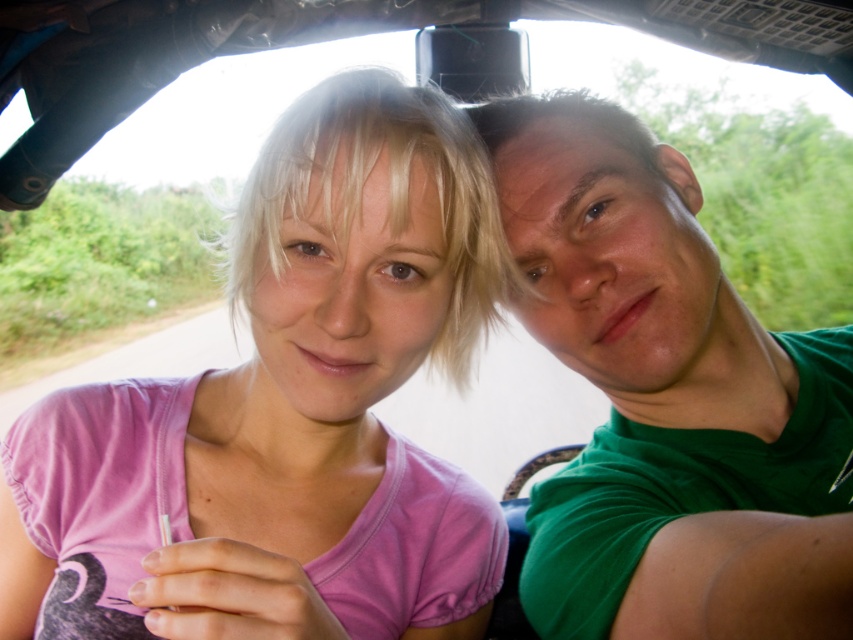
Question: Among these objects, which one is farthest from the camera?

Choices:
 (A) green matte shirt at right
 (B) pink fabric shirt at center

Answer: (B)

Question: Which point appears farthest from the camera in this image?

Choices:
 (A) click(578, 179)
 (B) click(149, 561)

Answer: (A)

Question: Which point is closer to the camera taking this photo?

Choices:
 (A) (804, 548)
 (B) (135, 406)

Answer: (A)

Question: Where is pink fabric shirt at center located in relation to green matte shirt at right in the image?

Choices:
 (A) left
 (B) right

Answer: (A)

Question: Does pink fabric shirt at center appear on the left side of green matte shirt at right?

Choices:
 (A) no
 (B) yes

Answer: (B)

Question: Does pink fabric shirt at center appear under green matte shirt at right?

Choices:
 (A) no
 (B) yes

Answer: (B)